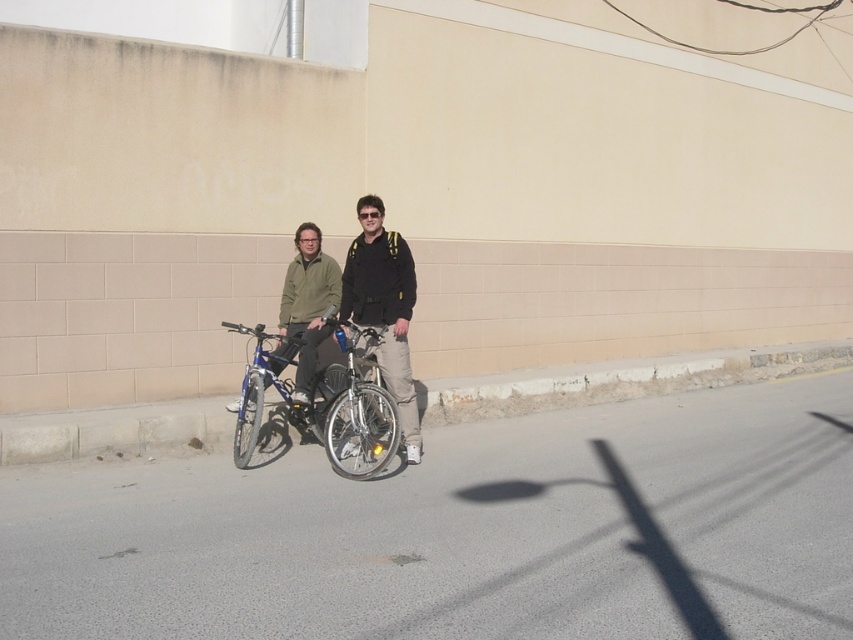
Question: Does matte black jacket at center appear under shiny metallic bicycle at center?

Choices:
 (A) yes
 (B) no

Answer: (B)

Question: Does shiny blue bicycle at center have a smaller size compared to matte black jacket at center?

Choices:
 (A) yes
 (B) no

Answer: (B)

Question: Estimate the real-world distances between objects in this image. Which object is closer to the matte black jacket at center?

Choices:
 (A) shiny metallic bicycle at center
 (B) matte black jackets at center
 (C) shiny blue bicycle at center

Answer: (B)

Question: Which object is positioned closest to the matte black jacket at center?

Choices:
 (A) shiny metallic bicycle at center
 (B) shiny blue bicycle at center

Answer: (A)

Question: Which point appears farthest from the camera in this image?

Choices:
 (A) (363, 308)
 (B) (364, 456)

Answer: (A)

Question: Does shiny blue bicycle at center have a lesser width compared to matte black jacket at center?

Choices:
 (A) yes
 (B) no

Answer: (B)